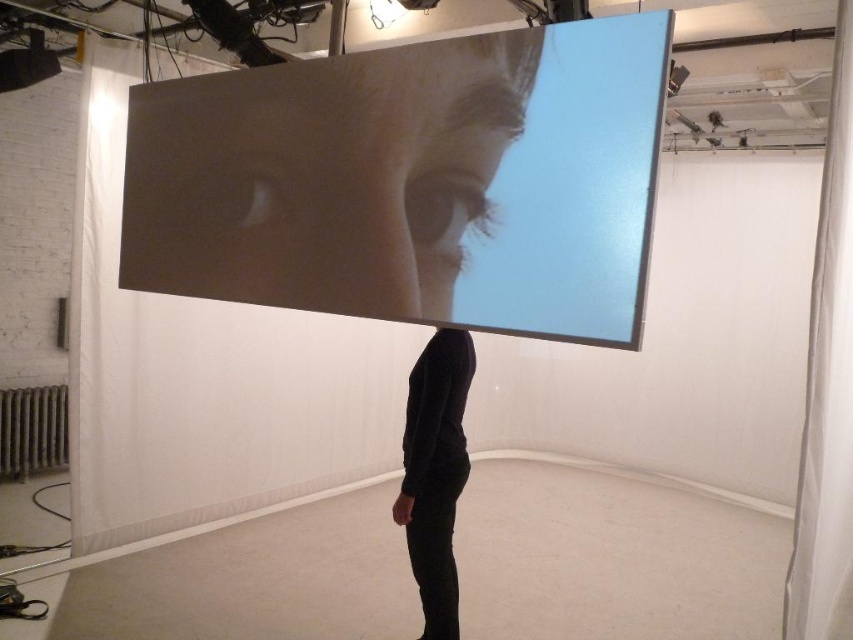
You are standing in the art gallery and want to take a photo of the smooth skin at upper center. If your camera has a minimum focusing distance of 5 feet, will you be able to take a clear photo without moving closer?

The smooth skin at upper center is 5.38 feet away from the viewer. Since the camera requires a minimum focusing distance of 5 feet, the distance is sufficient, so you can take a clear photo without moving closer.

You are an art curator planning to install a small decorative light near the projection screen. The light must be placed exactly at the point marked by the coordinates point (x=323, y=176). Based on the scene description, what surface or feature will the light be attached to?

The point (x=323, y=176) is described as smooth skin at upper center, which is part of the projected image of the person face displayed on the screen. Since the light needs to be placed on the projection screen itself, it should be attached to the screen surface at that coordinate.

You are an art curator planning to install a new sculpture between the smooth skin at upper center and the black matte shirt at center. Based on their positions, where should the sculpture be placed?

The sculpture should be placed below the smooth skin at upper center and above the black matte shirt at center since the smooth skin at upper center is located above the black matte shirt at center.